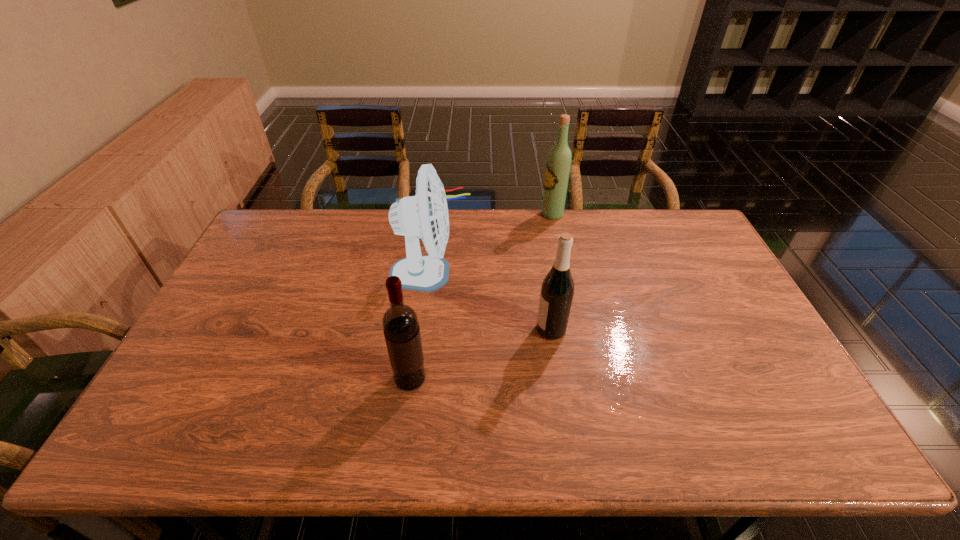
Locate which wine bottle is the second closest to the farthest object. Please provide its 2D coordinates. Your answer should be formatted as a tuple, i.e. [(x, y)], where the tuple contains the x and y coordinates of a point satisfying the conditions above.

[(400, 323)]